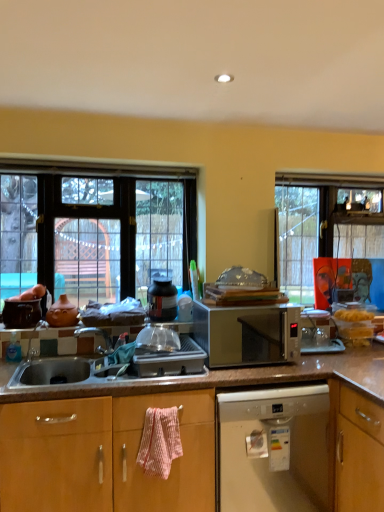
This screenshot has height=512, width=384. What do you see at coordinates (107, 232) in the screenshot? I see `clear glass window at left` at bounding box center [107, 232].

In order to face silver metallic microwave at center, should I rotate leftwards or rightwards?

Rotate your view right by about 6.853°.

Locate an element on the screen. matte black pot at center is located at coordinates (162, 298).

Where is `clear glass window at left`? The width and height of the screenshot is (384, 512). clear glass window at left is located at coordinates (107, 232).

Considering the relative sizes of matte black pot at center and silver metallic microwave at center in the image provided, is matte black pot at center smaller than silver metallic microwave at center?

Correct, matte black pot at center occupies less space than silver metallic microwave at center.

From a real-world perspective, is matte black pot at center located higher than silver metallic microwave at center?

Correct, in the physical world, matte black pot at center is higher than silver metallic microwave at center.

Does matte black pot at center appear on the left side of silver metallic microwave at center?

Yes.

Does matte black pot at center contain silver metallic microwave at center?

No, silver metallic microwave at center is not inside matte black pot at center.

Is pink textured towel at lower center in contact with silver metallic microwave at center?

No.

Considering the relative sizes of pink textured towel at lower center and silver metallic microwave at center in the image provided, is pink textured towel at lower center smaller than silver metallic microwave at center?

Yes, pink textured towel at lower center is smaller than silver metallic microwave at center.

Is pink textured towel at lower center to the left or to the right of silver metallic microwave at center in the image?

Clearly, pink textured towel at lower center is on the left of silver metallic microwave at center in the image.

Who is taller, clear glass window at left or silver metallic microwave at center?

With more height is clear glass window at left.

Considering the sizes of objects clear glass window at left and silver metallic microwave at center in the image provided, who is smaller, clear glass window at left or silver metallic microwave at center?

With smaller size is silver metallic microwave at center.

Is clear glass window at left closer to camera compared to silver metallic microwave at center?

No.

Is matte black pot at center positioned far away from clear glass window at left?

Actually, matte black pot at center and clear glass window at left are a little close together.

Is matte black pot at center bigger or smaller than clear glass window at left?

Considering their sizes, matte black pot at center takes up less space than clear glass window at left.

Is matte black pot at center not within clear glass window at left?

matte black pot at center is positioned outside clear glass window at left.

From the image's perspective, is matte black pot at center above clear glass window at left?

Actually, matte black pot at center appears below clear glass window at left in the image.

From a real-world perspective, is silver metallic microwave at center located beneath matte black pot at center?

Yes, from a real-world perspective, silver metallic microwave at center is beneath matte black pot at center.

Is silver metallic microwave at center aimed at matte black pot at center?

No, silver metallic microwave at center is not facing towards matte black pot at center.

In terms of width, does silver metallic microwave at center look wider or thinner when compared to matte black pot at center?

In the image, silver metallic microwave at center appears to be wider than matte black pot at center.

How many degrees apart are the facing directions of silver metallic microwave at center and matte black pot at center?

They differ by 2.44 degrees in their facing directions.

Is the surface of clear glass window at left in direct contact with matte black pot at center?

No, clear glass window at left is not touching matte black pot at center.

Does clear glass window at left turn towards matte black pot at center?

Yes, clear glass window at left is facing matte black pot at center.

From the image's perspective, is clear glass window at left under matte black pot at center?

No.

Is matte black pot at center positioned before white plastic dishwasher at lower center?

No, the depth of matte black pot at center is greater than that of white plastic dishwasher at lower center.

Is matte black pot at center turned away from white plastic dishwasher at lower center?

No, matte black pot at center's orientation is not away from white plastic dishwasher at lower center.

This screenshot has height=512, width=384. Identify the location of appliance that appears above the white plastic dishwasher at lower center (from the image's perspective). (162, 298).

Does matte black pot at center have a lesser height compared to white plastic dishwasher at lower center?

Yes, matte black pot at center is shorter than white plastic dishwasher at lower center.

Find the location of a particular element. The image size is (384, 512). appliance above the silver metallic microwave at center (from a real-world perspective) is located at coordinates (162, 298).

Identify the location of material below the silver metallic microwave at center (from a real-world perspective). (160, 441).

Considering their positions, is silver metallic microwave at center positioned further to pink textured towel at lower center than clear glass window at left?

The object further to pink textured towel at lower center is clear glass window at left.

From the image, which object appears to be farther from matte black pot at center, clear glass window at left or white plastic dishwasher at lower center?

white plastic dishwasher at lower center is further to matte black pot at center.

Estimate the real-world distances between objects in this image. Which object is further from pink textured towel at lower center, silver metallic microwave at center or matte black pot at center?

silver metallic microwave at center lies further to pink textured towel at lower center than the other object.

When comparing their distances from silver metallic microwave at center, does pink textured towel at lower center or clear glass window at left seem further?

clear glass window at left is positioned further to the anchor silver metallic microwave at center.

Looking at the image, which one is located closer to pink textured towel at lower center, clear glass window at left or white plastic dishwasher at lower center?

Based on the image, white plastic dishwasher at lower center appears to be nearer to pink textured towel at lower center.

In the scene shown: Based on their spatial positions, is matte black pot at center or clear glass window at left closer to pink textured towel at lower center?

matte black pot at center.

Considering their positions, is white plastic dishwasher at lower center positioned closer to pink textured towel at lower center than clear glass window at left?

The object closer to pink textured towel at lower center is white plastic dishwasher at lower center.

From the image, which object appears to be nearer to clear glass window at left, pink textured towel at lower center or silver metallic microwave at center?

silver metallic microwave at center.

The height and width of the screenshot is (512, 384). I want to click on microwave oven positioned between pink textured towel at lower center and matte black pot at center from near to far, so click(x=247, y=334).

Where is `appliance between clear glass window at left and white plastic dishwasher at lower center in the up-down direction`? This screenshot has width=384, height=512. appliance between clear glass window at left and white plastic dishwasher at lower center in the up-down direction is located at coordinates (162, 298).

Image resolution: width=384 pixels, height=512 pixels. I want to click on material between silver metallic microwave at center and white plastic dishwasher at lower center in the up-down direction, so click(160, 441).

The height and width of the screenshot is (512, 384). In order to click on microwave oven between clear glass window at left and pink textured towel at lower center vertically in this screenshot , I will do (247, 334).